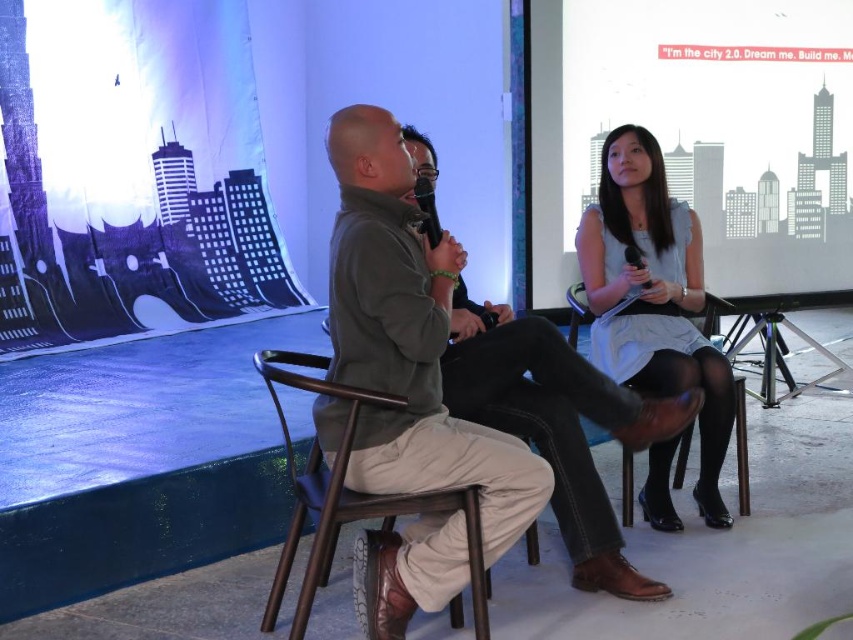
Does white satin dress at right have a lesser height compared to brown wood chair at center?

No.

The width and height of the screenshot is (853, 640). What are the coordinates of `white satin dress at right` in the screenshot? It's located at (653, 298).

Is point (672, 195) positioned before point (634, 282)?

That is False.

Does white matte projection screen at upper center appear on the left side of white satin dress at right?

No, white matte projection screen at upper center is not to the left of white satin dress at right.

Is point (817, 237) positioned in front of point (618, 346)?

No.

Find the location of a particular element. This screenshot has height=640, width=853. white matte projection screen at upper center is located at coordinates coord(700,131).

Can you confirm if white satin dress at right is taller than khaki cotton pants at center?

Yes.

Who is more distant from viewer, [705,515] or [595,397]?

The point [705,515] is behind.

Is point (700, 272) positioned after point (575, 474)?

Yes.

Where is `white satin dress at right`? white satin dress at right is located at coordinates (653, 298).